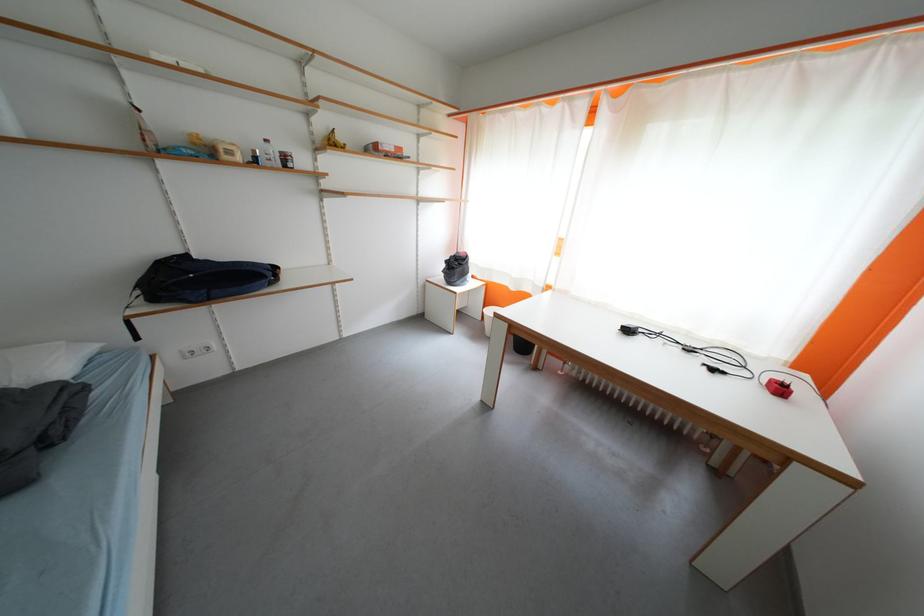
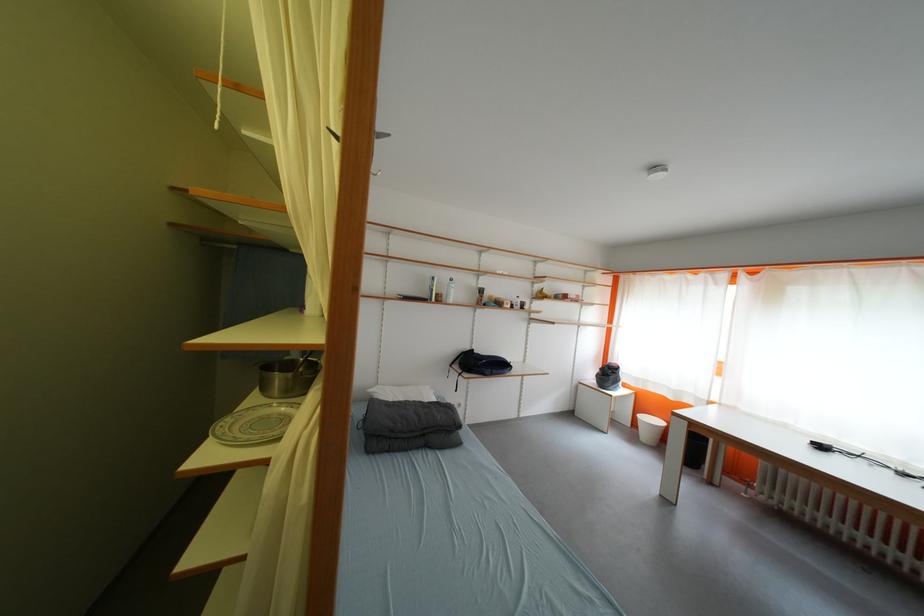
In the second image, find the point that corresponds to the point at 149,296 in the first image.

(466, 370)